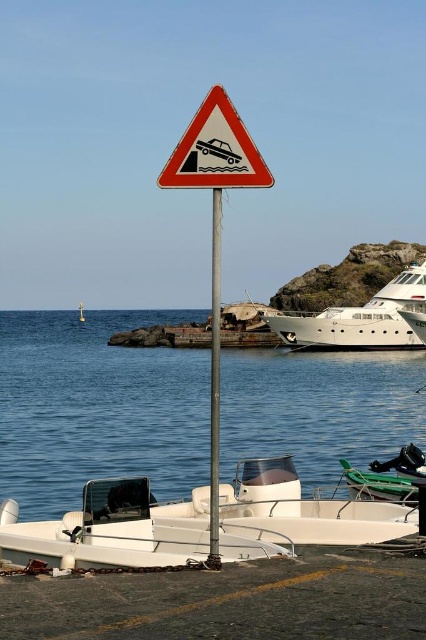
Question: Is white glossy boat at center below green plastic boat at lower right?

Choices:
 (A) yes
 (B) no

Answer: (B)

Question: Is metallic pole at center in front of green plastic boat at lower right?

Choices:
 (A) yes
 (B) no

Answer: (A)

Question: Estimate the real-world distances between objects in this image. Which object is closer to the blue water at lower center?

Choices:
 (A) white glossy yacht at right
 (B) white matte boat at lower center
 (C) white glossy boat at center
 (D) metallic pole at center

Answer: (A)

Question: Which point is farther from the camera taking this photo?

Choices:
 (A) click(258, 458)
 (B) click(310, 344)
 (C) click(271, 548)

Answer: (B)

Question: Observing the image, what is the correct spatial positioning of white glossy yacht at right in reference to green plastic boat at lower right?

Choices:
 (A) right
 (B) left

Answer: (A)

Question: Which of the following is the farthest from the observer?

Choices:
 (A) (299, 328)
 (B) (210, 560)

Answer: (A)